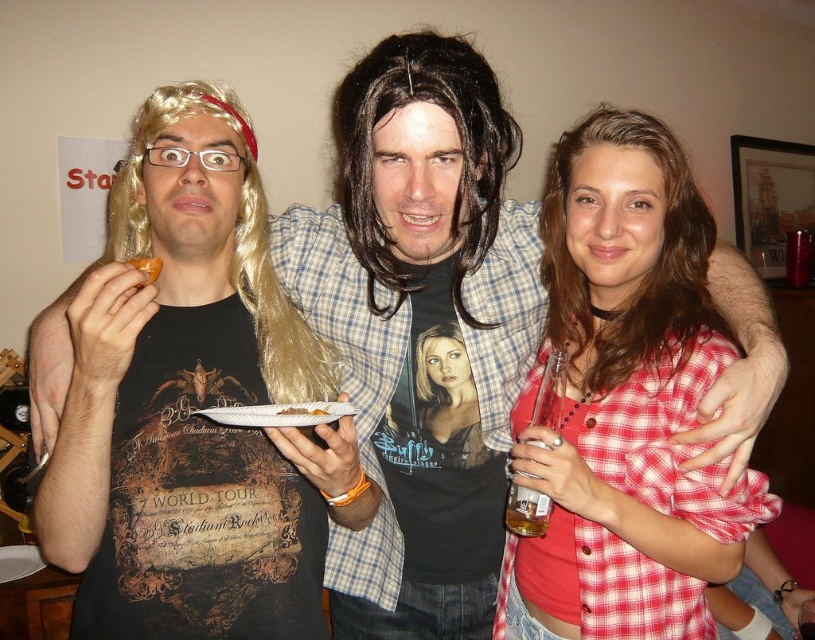
You are a photographer at this gathering and want to ensure both the matte red plaid shirt at center and the orange flesh at center are clearly visible in your photo. Given their sizes, which object should you focus on to capture both without cropping?

The matte red plaid shirt at center is larger than the orange flesh at center, so focusing on the matte red plaid shirt at center would ensure both are visible without cropping.

You are a food critic attending a party and notice two dishes on the table. The orange flesh at center and the savory meat at plate center. Which dish has a bigger portion?

The orange flesh at center has a bigger portion than the savory meat at plate center.

Looking at the scene, which object is taller between the matte red plaid shirt at center and the orange flesh at center?

The matte red plaid shirt at center is taller than the orange flesh at center.